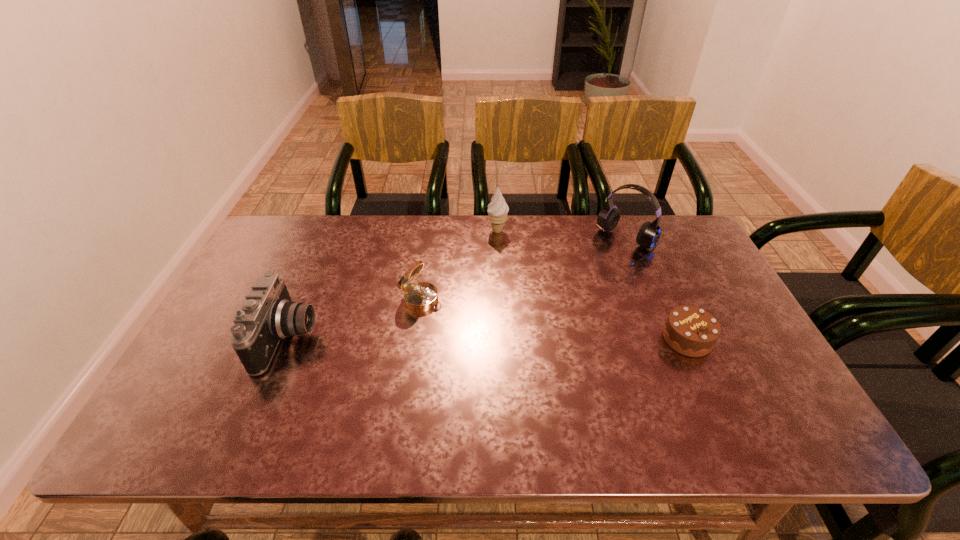
The image size is (960, 540). Identify the location of vacant space located 0.130m with the dial facing the second object from left to right. pyautogui.click(x=476, y=325).

At what (x,y) coordinates should I click in order to perform the action: click on vacant area located on the front-facing side of the icecream. Please return your answer as a coordinate pair (x, y). The image size is (960, 540). Looking at the image, I should click on (496, 296).

Where is `vacant space situated on the front-facing side of the icecream`? The height and width of the screenshot is (540, 960). vacant space situated on the front-facing side of the icecream is located at coordinates (497, 280).

At what (x,y) coordinates should I click in order to perform the action: click on free space located on the front-facing side of the icecream. Please return your answer as a coordinate pair (x, y). Looking at the image, I should click on (496, 299).

The height and width of the screenshot is (540, 960). I want to click on vacant space located on the ear cushions of the headset, so click(x=546, y=336).

The width and height of the screenshot is (960, 540). Identify the location of vacant space located on the ear cushions of the headset. (608, 274).

Locate an element on the screen. vacant area situated on the ear cushions of the headset is located at coordinates tap(560, 323).

Image resolution: width=960 pixels, height=540 pixels. What are the coordinates of `icecream positioned at the far edge` in the screenshot? It's located at (497, 211).

Locate an element on the screen. headset that is positioned at the far edge is located at coordinates (648, 236).

Where is `object positioned at the near edge`? This screenshot has width=960, height=540. object positioned at the near edge is located at coordinates click(x=267, y=315).